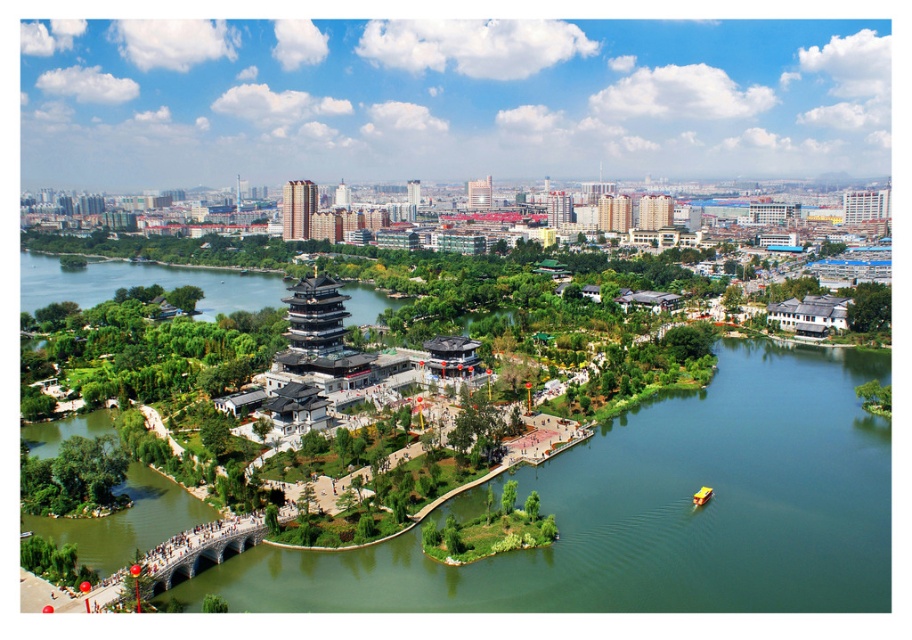
Question: Is green water at center wider than yellow plastic boat at lower right?

Choices:
 (A) no
 (B) yes

Answer: (B)

Question: Which point is farther to the camera?

Choices:
 (A) yellow plastic boat at lower right
 (B) green water at center

Answer: (A)

Question: Which point appears closest to the camera in this image?

Choices:
 (A) (698, 500)
 (B) (59, 429)

Answer: (A)

Question: Can you confirm if green water at center is thinner than yellow plastic boat at lower right?

Choices:
 (A) no
 (B) yes

Answer: (A)

Question: Which point is farther to the camera?

Choices:
 (A) (794, 611)
 (B) (707, 499)

Answer: (B)

Question: In this image, where is green water at center located relative to yellow plastic boat at lower right?

Choices:
 (A) above
 (B) below

Answer: (A)